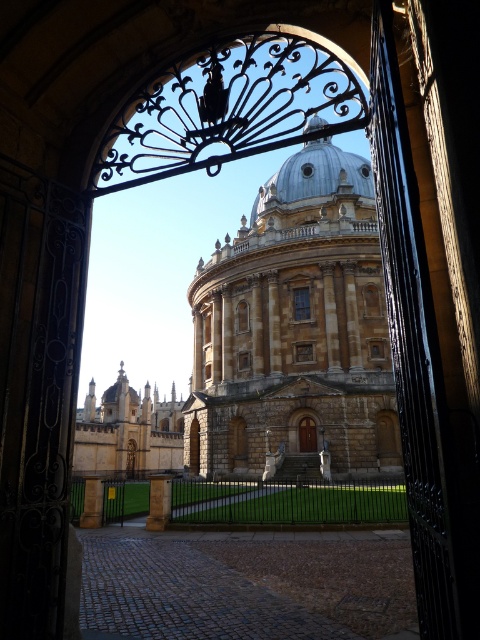
Question: Is metallic silver dome at center wider than stone pillar at center?

Choices:
 (A) no
 (B) yes

Answer: (B)

Question: Which object is positioned farthest from the metallic silver dome at center?

Choices:
 (A) smooth stone pillar at center
 (B) stone dome at center

Answer: (A)

Question: Considering the real-world distances, which object is farthest from the metallic silver dome at center?

Choices:
 (A) brown wooden door at center
 (B) smooth stone pillar at center
 (C) stone pillar at center

Answer: (B)

Question: Observing the image, what is the correct spatial positioning of stone dome at center in reference to smooth stone pillar at center?

Choices:
 (A) right
 (B) left

Answer: (A)

Question: Is stone dome at center above metallic silver dome at center?

Choices:
 (A) yes
 (B) no

Answer: (B)

Question: Which object appears closest to the camera in this image?

Choices:
 (A) brown wooden door at center
 (B) stone dome at center
 (C) stone pillar at center
 (D) metallic silver dome at center

Answer: (C)